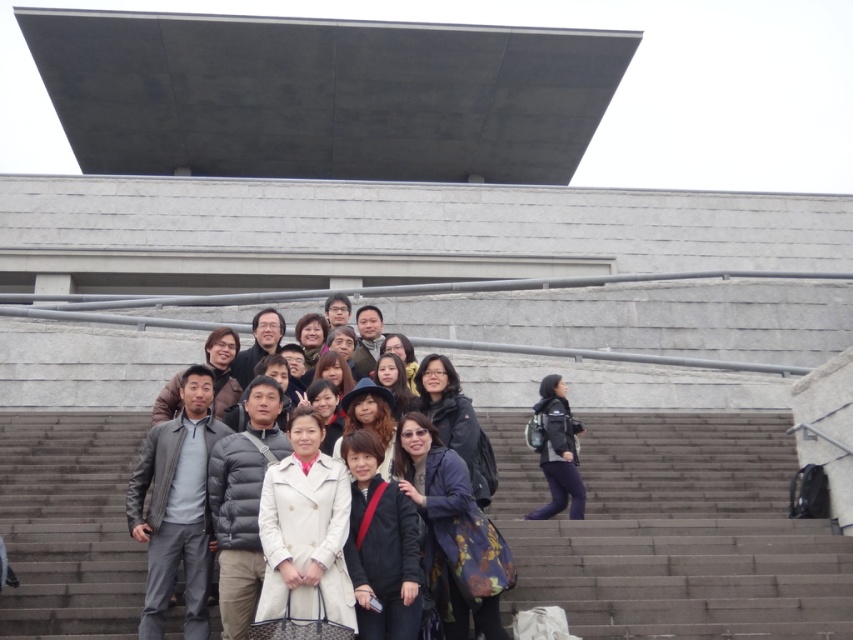
Question: Can you confirm if gray concrete stairs at center is bigger than dark blue textured coat at center?

Choices:
 (A) no
 (B) yes

Answer: (B)

Question: Which object appears farthest from the camera in this image?

Choices:
 (A) black matte jacket at center
 (B) white down jacket at center
 (C) dark blue textured coat at center

Answer: (C)

Question: Which is farther from the gray concrete stairs at center?

Choices:
 (A) dark blue textured coat at center
 (B) dark blue fabric jacket at right
 (C) matte black glasses at center
 (D) white down jacket at center

Answer: (C)

Question: Among these points, which one is farthest from the camera?

Choices:
 (A) (550, 502)
 (B) (699, 502)
 (C) (282, 502)

Answer: (B)

Question: Is the position of beige wool coat at center less distant than that of white down jacket at center?

Choices:
 (A) no
 (B) yes

Answer: (B)

Question: Is dark blue textured coat at center in front of matte black glasses at center?

Choices:
 (A) yes
 (B) no

Answer: (A)